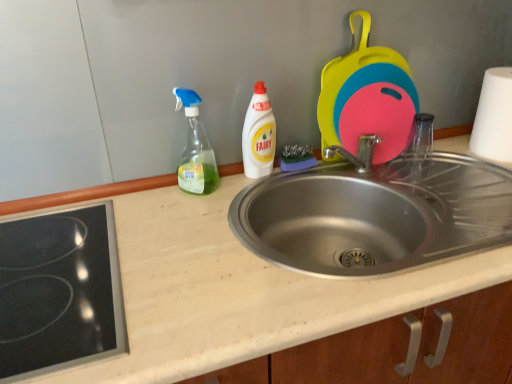
Question: Is white matte paper towel at right positioned beyond the bounds of beige laminate counter top at center?

Choices:
 (A) yes
 (B) no

Answer: (A)

Question: Is white matte paper towel at right further to the viewer compared to beige laminate counter top at center?

Choices:
 (A) no
 (B) yes

Answer: (B)

Question: Considering the relative positions of white matte paper towel at right and beige laminate counter top at center in the image provided, is white matte paper towel at right to the left of beige laminate counter top at center from the viewer's perspective?

Choices:
 (A) yes
 (B) no

Answer: (B)

Question: Is beige laminate counter top at center at the back of white matte paper towel at right?

Choices:
 (A) yes
 (B) no

Answer: (B)

Question: Would you say white matte paper towel at right is a long distance from beige laminate counter top at center?

Choices:
 (A) no
 (B) yes

Answer: (A)

Question: Can you confirm if white matte paper towel at right is positioned to the right of beige laminate counter top at center?

Choices:
 (A) yes
 (B) no

Answer: (A)

Question: Considering the relative positions of beige laminate counter top at center and white plastic bottle at center, which is the first bottle from right to left, in the image provided, is beige laminate counter top at center to the right of white plastic bottle at center, which is the first bottle from right to left, from the viewer's perspective?

Choices:
 (A) yes
 (B) no

Answer: (A)

Question: Considering the relative sizes of beige laminate counter top at center and white plastic bottle at center, which is the first bottle from right to left, in the image provided, is beige laminate counter top at center wider than white plastic bottle at center, which is the first bottle from right to left,?

Choices:
 (A) yes
 (B) no

Answer: (A)

Question: Considering the relative sizes of beige laminate counter top at center and white plastic bottle at center, which ranks as the 2th bottle in left-to-right order, in the image provided, is beige laminate counter top at center bigger than white plastic bottle at center, which ranks as the 2th bottle in left-to-right order,?

Choices:
 (A) no
 (B) yes

Answer: (B)

Question: From the image's perspective, is beige laminate counter top at center below white plastic bottle at center, which is the first bottle from right to left?

Choices:
 (A) no
 (B) yes

Answer: (B)

Question: From the image's perspective, does beige laminate counter top at center appear higher than white plastic bottle at center, which is the first bottle from right to left?

Choices:
 (A) no
 (B) yes

Answer: (A)

Question: Is beige laminate counter top at center located outside white plastic bottle at center, which ranks as the 2th bottle in left-to-right order?

Choices:
 (A) no
 (B) yes

Answer: (B)

Question: Would you say silicone cutting boards at upper right is a long distance from beige laminate counter top at center?

Choices:
 (A) yes
 (B) no

Answer: (B)